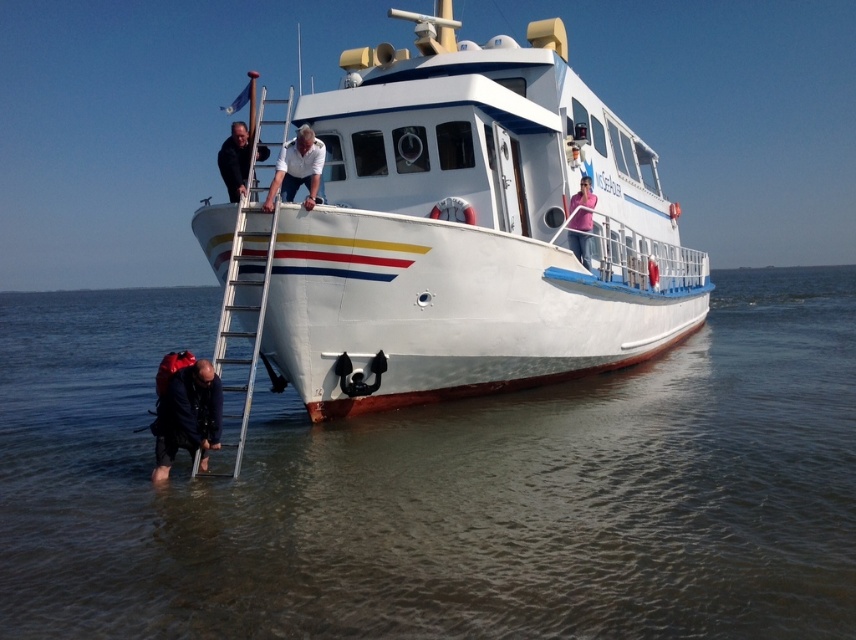
Question: In this image, where is clear water at lower left located relative to black fabric at upper center?

Choices:
 (A) above
 (B) below

Answer: (B)

Question: Which point is closer to the camera?

Choices:
 (A) black fabric at upper center
 (B) clear water at lower left
 (C) pink fabric shirt at upper center
 (D) silver metallic ladder at center

Answer: (B)

Question: Estimate the real-world distances between objects in this image. Which object is farther from the black fabric at upper center?

Choices:
 (A) dark blue backpack at lower left
 (B) white smooth shirt at upper center
 (C) white glossy boat at center
 (D) pink fabric shirt at upper center

Answer: (C)

Question: Which point is farther to the camera?

Choices:
 (A) (232, 136)
 (B) (284, 166)

Answer: (A)

Question: Does clear water at lower left appear over white smooth shirt at upper center?

Choices:
 (A) yes
 (B) no

Answer: (A)

Question: Considering the relative positions of clear water at lower left and black fabric at upper center in the image provided, where is clear water at lower left located with respect to black fabric at upper center?

Choices:
 (A) right
 (B) left

Answer: (A)